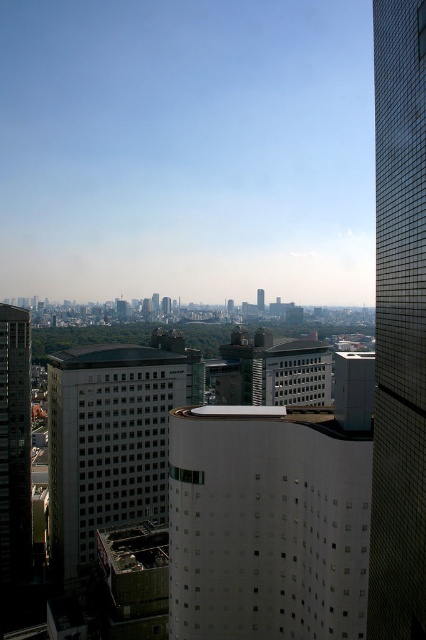
In the scene shown: Based on the scene description, where is the glassy reflective skyscraper at right located in the image?

The glassy reflective skyscraper at right is located at point (x=399, y=324) in the image.

You are standing in the cityscape and want to know how far the point at coordinates (x=293, y=637) is from you. Can you determine the distance?

The point at coordinates (x=293, y=637) is 91.86 meters away from you.

In the scene shown: You are standing at the viewpoint where the image was taken and want to walk towards the point at the bottom right corner of the image. There is an obstacle at point (411, 563) and another at (62, 426). Which obstacle should you avoid first?

You should avoid the obstacle at point (411, 563) first because it is closer to you than the obstacle at (62, 426), which is further away.